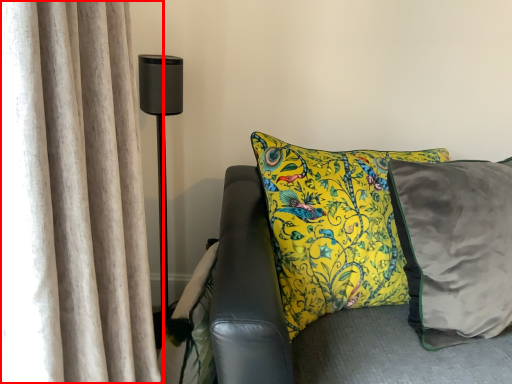
Question: From the image's perspective, where is curtain (annotated by the red box) located relative to table lamp?

Choices:
 (A) below
 (B) above

Answer: (A)